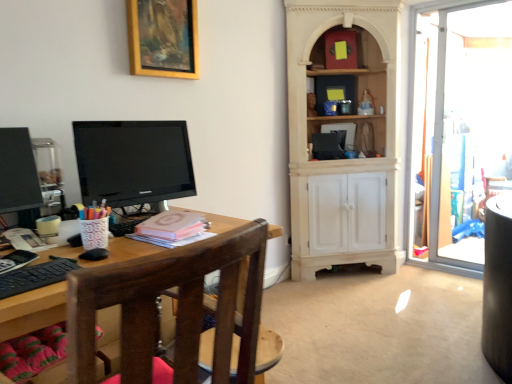
Question: Does gold wooden picture frame at upper center have a greater height compared to brown wooden chair at left?

Choices:
 (A) no
 (B) yes

Answer: (A)

Question: Does gold wooden picture frame at upper center lie in front of brown wooden chair at left?

Choices:
 (A) no
 (B) yes

Answer: (A)

Question: Is brown wooden chair at left inside gold wooden picture frame at upper center?

Choices:
 (A) yes
 (B) no

Answer: (B)

Question: Does gold wooden picture frame at upper center lie behind brown wooden chair at left?

Choices:
 (A) yes
 (B) no

Answer: (A)

Question: Is gold wooden picture frame at upper center completely or partially outside of brown wooden chair at left?

Choices:
 (A) no
 (B) yes

Answer: (B)

Question: Is point (165, 291) closer or farther from the camera than point (135, 11)?

Choices:
 (A) farther
 (B) closer

Answer: (B)

Question: From the image's perspective, relative to gold wooden picture frame at upper center, is brown wooden chair at left above or below?

Choices:
 (A) below
 (B) above

Answer: (A)

Question: Is brown wooden chair at left wider or thinner than gold wooden picture frame at upper center?

Choices:
 (A) wide
 (B) thin

Answer: (A)

Question: From their relative heights in the image, would you say brown wooden chair at left is taller or shorter than gold wooden picture frame at upper center?

Choices:
 (A) short
 (B) tall

Answer: (B)

Question: Is point (487, 158) closer or farther from the camera than point (220, 268)?

Choices:
 (A) farther
 (B) closer

Answer: (A)

Question: Looking at their shapes, would you say transparent glass door at right is wider or thinner than brown wooden chair at left?

Choices:
 (A) wide
 (B) thin

Answer: (B)

Question: From a real-world perspective, is transparent glass door at right above or below brown wooden chair at left?

Choices:
 (A) above
 (B) below

Answer: (A)

Question: Considering the positions of transparent glass door at right and brown wooden chair at left in the image, is transparent glass door at right bigger or smaller than brown wooden chair at left?

Choices:
 (A) small
 (B) big

Answer: (A)

Question: Is gold wooden picture frame at upper center wider or thinner than matte black monitor at left?

Choices:
 (A) thin
 (B) wide

Answer: (A)

Question: Based on their sizes in the image, would you say gold wooden picture frame at upper center is bigger or smaller than matte black monitor at left?

Choices:
 (A) small
 (B) big

Answer: (B)